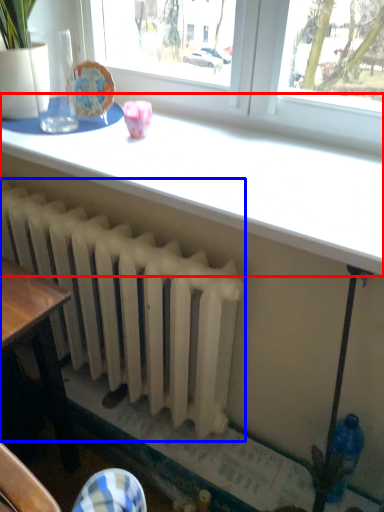
Question: Which object appears closest to the camera in this image, table (highlighted by a red box) or radiator (highlighted by a blue box)?

Choices:
 (A) table
 (B) radiator

Answer: (A)